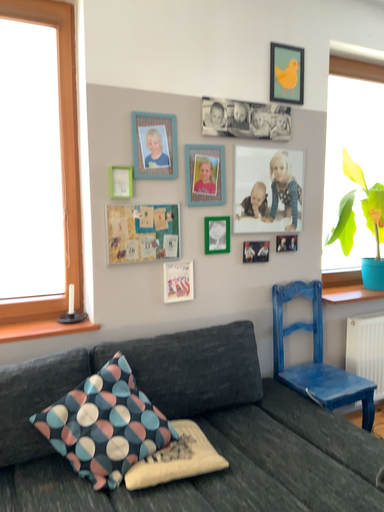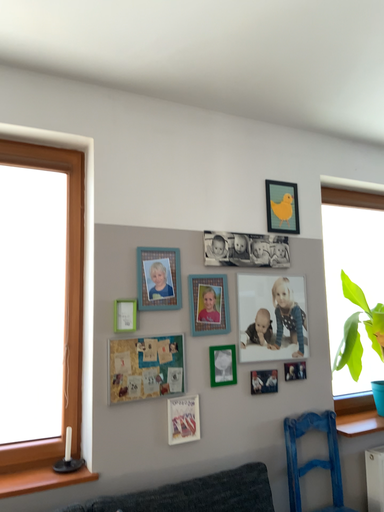
Question: Which way did the camera rotate in the video?

Choices:
 (A) rotated upward
 (B) rotated downward

Answer: (A)